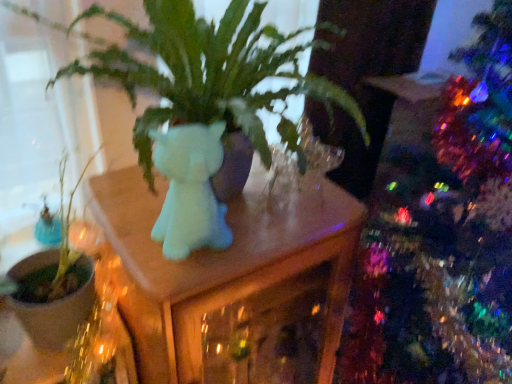
At what (x,y) coordinates should I click in order to perform the action: click on vacant region in front of matte white cat at center. Please return your answer as a coordinate pair (x, y). The height and width of the screenshot is (384, 512). Looking at the image, I should click on (172, 268).